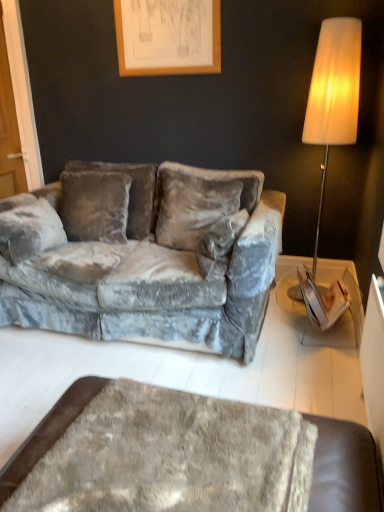
Where is `wooden picture frame at upper center`? The height and width of the screenshot is (512, 384). wooden picture frame at upper center is located at coordinates (168, 36).

Locate an element on the screen. The height and width of the screenshot is (512, 384). fuzzy brown ottoman at lower center is located at coordinates (345, 468).

In the scene shown: From the image's perspective, does wooden picture frame at upper center appear higher than fuzzy brown ottoman at lower center?

Indeed, from the image's perspective, wooden picture frame at upper center is shown above fuzzy brown ottoman at lower center.

Who is smaller, wooden picture frame at upper center or fuzzy brown ottoman at lower center?

With smaller size is wooden picture frame at upper center.

Is wooden picture frame at upper center taller or shorter than fuzzy brown ottoman at lower center?

Clearly, wooden picture frame at upper center is taller compared to fuzzy brown ottoman at lower center.

Does wooden picture frame at upper center appear on the right side of fuzzy brown ottoman at lower center?

In fact, wooden picture frame at upper center is to the left of fuzzy brown ottoman at lower center.

Which is correct: velvet gray couch at center is inside fuzzy brown ottoman at lower center, or outside of it?

velvet gray couch at center is spatially situated outside fuzzy brown ottoman at lower center.

How many degrees apart are the facing directions of velvet gray couch at center and fuzzy brown ottoman at lower center?

90.7 degrees.

From a real-world perspective, is velvet gray couch at center above or below fuzzy brown ottoman at lower center?

In terms of real-world spatial position, velvet gray couch at center is above fuzzy brown ottoman at lower center.

Which object is closer to the camera, velvet gray couch at center or fuzzy brown ottoman at lower center?

fuzzy brown ottoman at lower center is closer to the camera.

Is fuzzy brown ottoman at lower center oriented away from velvet gray couch at center?

No.

Is fuzzy brown ottoman at lower center beside velvet gray couch at center?

No.

Considering the positions of objects fuzzy brown ottoman at lower center and velvet gray couch at center in the image provided, who is more to the right, fuzzy brown ottoman at lower center or velvet gray couch at center?

Positioned to the right is fuzzy brown ottoman at lower center.

At what (x,y) coordinates should I click in order to perform the action: click on table in front of the velvet gray couch at center. Please return your answer as a coordinate pair (x, y). Image resolution: width=384 pixels, height=512 pixels. Looking at the image, I should click on click(x=345, y=468).

Is point (120, 50) positioned behind point (53, 283)?

Yes, it is behind point (53, 283).

Do you think wooden picture frame at upper center is within velvet gray couch at center, or outside of it?

wooden picture frame at upper center is located beyond the bounds of velvet gray couch at center.

Is the depth of wooden picture frame at upper center greater than that of velvet gray couch at center?

Yes, it is behind velvet gray couch at center.

Considering the positions of objects wooden picture frame at upper center and velvet gray couch at center in the image provided, who is more to the left, wooden picture frame at upper center or velvet gray couch at center?

velvet gray couch at center.

Considering the positions of objects velvet gray couch at center and wooden picture frame at upper center in the image provided, who is behind, velvet gray couch at center or wooden picture frame at upper center?

wooden picture frame at upper center.

Between velvet gray couch at center and wooden picture frame at upper center, which one has smaller size?

With smaller size is wooden picture frame at upper center.

Is velvet gray couch at center not near wooden picture frame at upper center?

velvet gray couch at center is positioned a significant distance from wooden picture frame at upper center.

From a real-world perspective, who is located lower, velvet gray couch at center or wooden picture frame at upper center?

velvet gray couch at center.

Does point (360, 495) appear closer or farther from the camera than point (121, 18)?

Clearly, point (360, 495) is closer to the camera than point (121, 18).

Which object is positioned more to the right, fuzzy brown ottoman at lower center or wooden picture frame at upper center?

From the viewer's perspective, fuzzy brown ottoman at lower center appears more on the right side.

Considering the relative positions of fuzzy brown ottoman at lower center and wooden picture frame at upper center in the image provided, is fuzzy brown ottoman at lower center behind wooden picture frame at upper center?

That is False.

Is fuzzy brown ottoman at lower center beside wooden picture frame at upper center?

No, fuzzy brown ottoman at lower center is not in contact with wooden picture frame at upper center.

I want to click on picture frame positioned vertically above the fuzzy brown ottoman at lower center (from a real-world perspective), so click(x=168, y=36).

Locate an element on the screen. Image resolution: width=384 pixels, height=512 pixels. table below the velvet gray couch at center (from the image's perspective) is located at coordinates (345, 468).

Which object lies nearer to the anchor point fuzzy brown ottoman at lower center, wooden picture frame at upper center or velvet gray couch at center?

Among the two, velvet gray couch at center is located nearer to fuzzy brown ottoman at lower center.

Which object lies further to the anchor point velvet gray couch at center, fuzzy brown ottoman at lower center or wooden picture frame at upper center?

The object further to velvet gray couch at center is fuzzy brown ottoman at lower center.

Which object lies nearer to the anchor point velvet gray couch at center, wooden picture frame at upper center or fuzzy brown ottoman at lower center?

wooden picture frame at upper center lies closer to velvet gray couch at center than the other object.

Which object lies further to the anchor point wooden picture frame at upper center, velvet gray couch at center or fuzzy brown ottoman at lower center?

Among the two, fuzzy brown ottoman at lower center is located further to wooden picture frame at upper center.

Estimate the real-world distances between objects in this image. Which object is closer to wooden picture frame at upper center, fuzzy brown ottoman at lower center or velvet gray couch at center?

velvet gray couch at center.

Based on their spatial positions, is velvet gray couch at center or wooden picture frame at upper center further from fuzzy brown ottoman at lower center?

wooden picture frame at upper center is positioned further to the anchor fuzzy brown ottoman at lower center.

You are a GUI agent. You are given a task and a screenshot of the screen. Output one action in this format:
    pyautogui.click(x=<x>, y=<y>)
    Task: Click on the studio couch that lies between wooden picture frame at upper center and fuzzy brown ottoman at lower center from top to bottom
    This screenshot has height=512, width=384.
    Given the screenshot: What is the action you would take?
    pyautogui.click(x=145, y=255)